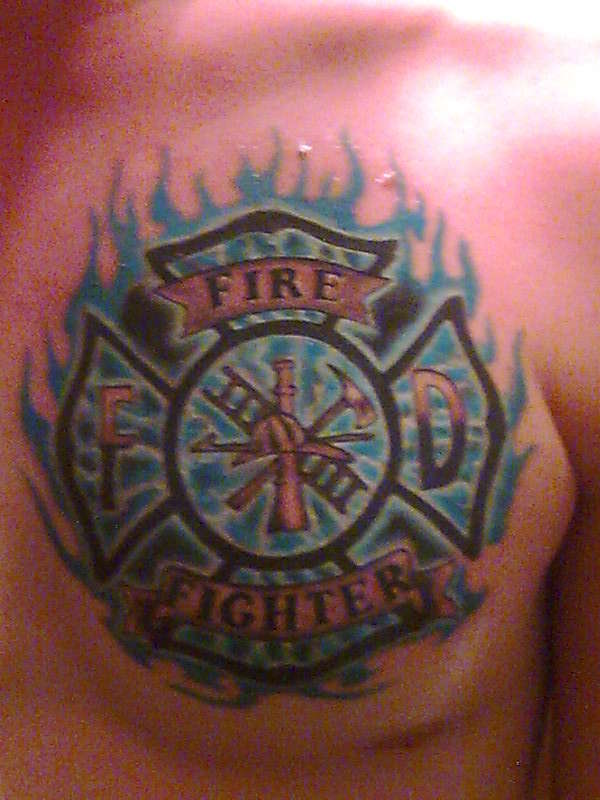
Where is `ladder`? ladder is located at coordinates (328, 477).